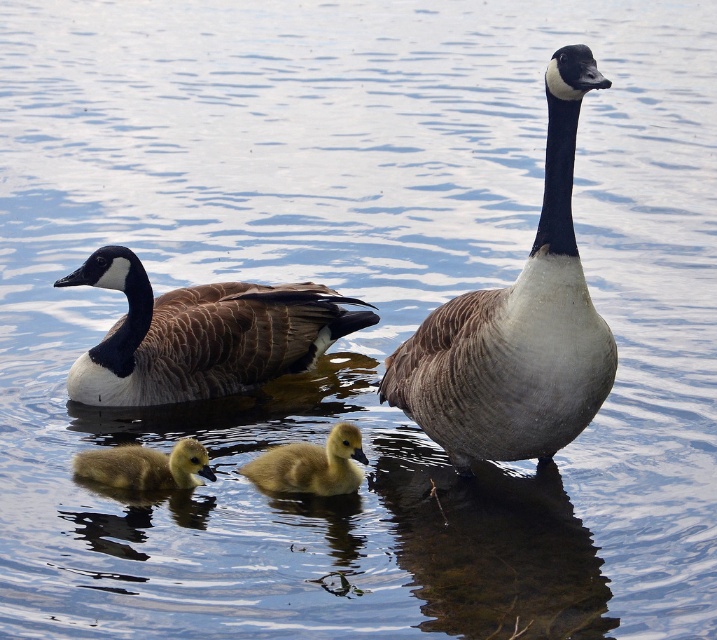
Is point (348, 298) farther from camera compared to point (105, 481)?

Yes, it is behind point (105, 481).

Does brown feathered goose at left appear under golden downy duckling at lower left?

Incorrect, brown feathered goose at left is not positioned below golden downy duckling at lower left.

Between point (125, 275) and point (85, 476), which one is positioned in front?

Point (85, 476) is more forward.

Identify the location of brown feathered goose at left. (201, 333).

Is golden downy duckling at center bigger than golden downy duckling at lower left?

Yes.

Does golden downy duckling at center have a greater width compared to golden downy duckling at lower left?

No, golden downy duckling at center is not wider than golden downy duckling at lower left.

Is point (338, 470) farther from viewer compared to point (158, 477)?

No, (338, 470) is closer to viewer.

The height and width of the screenshot is (640, 717). Identify the location of golden downy duckling at center. (310, 465).

Which is more to the left, matte brown goose at center or brown feathered goose at left?

Positioned to the left is brown feathered goose at left.

Can you confirm if matte brown goose at center is shorter than brown feathered goose at left?

No.

From the picture: Who is more forward, (x=526, y=424) or (x=136, y=298)?

Point (x=526, y=424) is more forward.

Where is `matte brown goose at center`? The image size is (717, 640). matte brown goose at center is located at coordinates (516, 326).